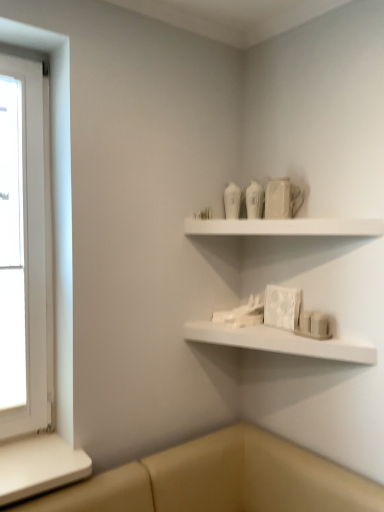
Question: Considering the positions of white matte shelf at lower center, the 2th shelf viewed from the top, and white matte shelf at upper center, which ranks as the first shelf in top-to-bottom order, in the image, is white matte shelf at lower center, the 2th shelf viewed from the top, wider or thinner than white matte shelf at upper center, which ranks as the first shelf in top-to-bottom order,?

Choices:
 (A) thin
 (B) wide

Answer: (B)

Question: Looking at the image, does white matte shelf at lower center, the 2th shelf viewed from the top, seem bigger or smaller compared to white matte shelf at upper center, which ranks as the first shelf in top-to-bottom order?

Choices:
 (A) big
 (B) small

Answer: (A)

Question: Considering the real-world distances, which object is closest to the white matte shelf at upper center, which ranks as the first shelf in top-to-bottom order?

Choices:
 (A) white wooden window at left
 (B) white matte shelf at lower center, which is the 1th shelf in bottom-to-top order

Answer: (B)

Question: Which object is positioned closest to the white matte shelf at lower center, the 2th shelf viewed from the top?

Choices:
 (A) white wooden window at left
 (B) white matte shelf at upper center, the second shelf when ordered from bottom to top

Answer: (B)